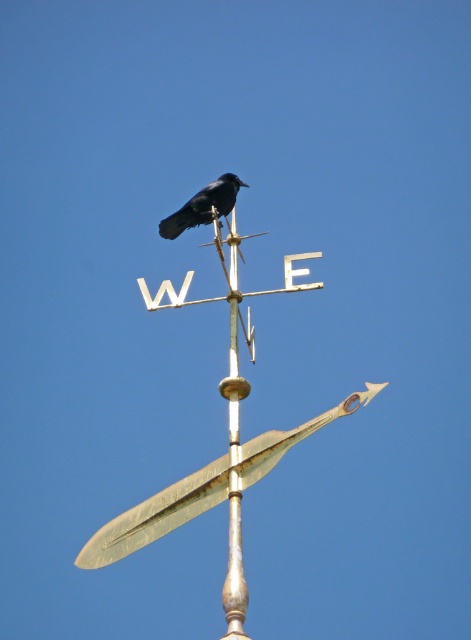
You are an ornithologist observing the weather vane. You need to determine which object is larger between the polished brass pole at center and the black matte bird at center. Which one is larger?

The polished brass pole at center is bigger than the black matte bird at center, so the polished brass pole at center is larger.

You are an architect designing a new garden ornament. You need to ensure that the polished brass pole at center and the black matte bird at center will fit within a 10 cm wide base. Given their widths, can both objects fit side by side on the base without overlapping?

The polished brass pole at center is narrower than the black matte bird at center. However, since the combined width of both objects exceeds 10 cm, they cannot fit side by side on the base without overlapping.

You are an architect designing a new garden feature and want to ensure proper airflow around the weather vane. Given the gold polished metal spire at center and the polished brass pole at center, which object has a larger diameter to potentially block more wind?

The gold polished metal spire at center might be wider than the polished brass pole at center, so it could block more wind.